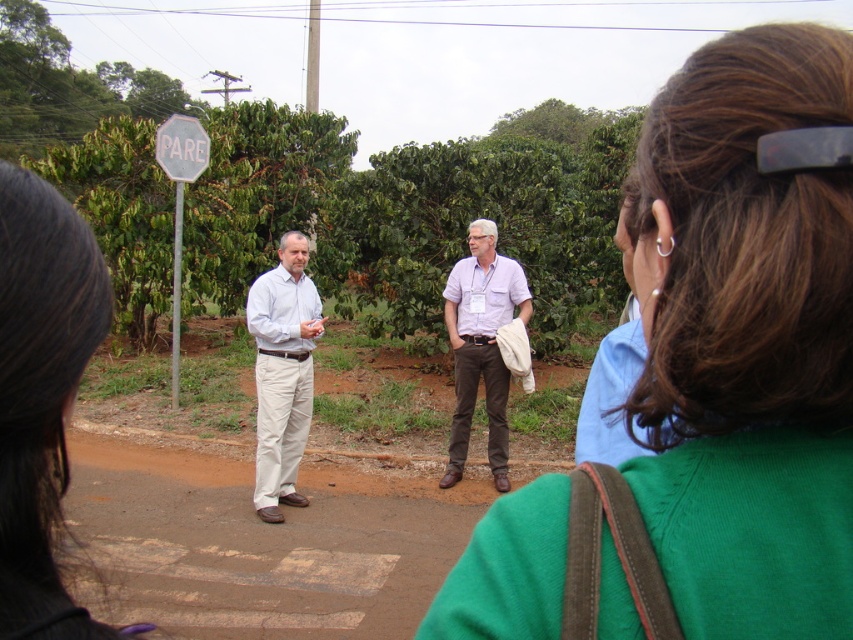
Which of these two, green fabric at center or matte white shirt at center, stands shorter?

Standing shorter between the two is green fabric at center.

Describe the element at coordinates (746, 339) in the screenshot. The image size is (853, 640). I see `green fabric at center` at that location.

What are the coordinates of `green fabric at center` in the screenshot? It's located at (746, 339).

Based on the photo, which is above, black hair at upper left or matte white shirt at center?

black hair at upper left is higher up.

Locate an element on the screen. The width and height of the screenshot is (853, 640). black hair at upper left is located at coordinates (42, 397).

Which is behind, point (732, 323) or point (473, 257)?

The point (473, 257) is more distant.

Is green fabric at center above light purple shirt at center?

Correct, green fabric at center is located above light purple shirt at center.

This screenshot has height=640, width=853. Describe the element at coordinates (746, 339) in the screenshot. I see `green fabric at center` at that location.

The image size is (853, 640). Find the location of `green fabric at center`. green fabric at center is located at coordinates (746, 339).